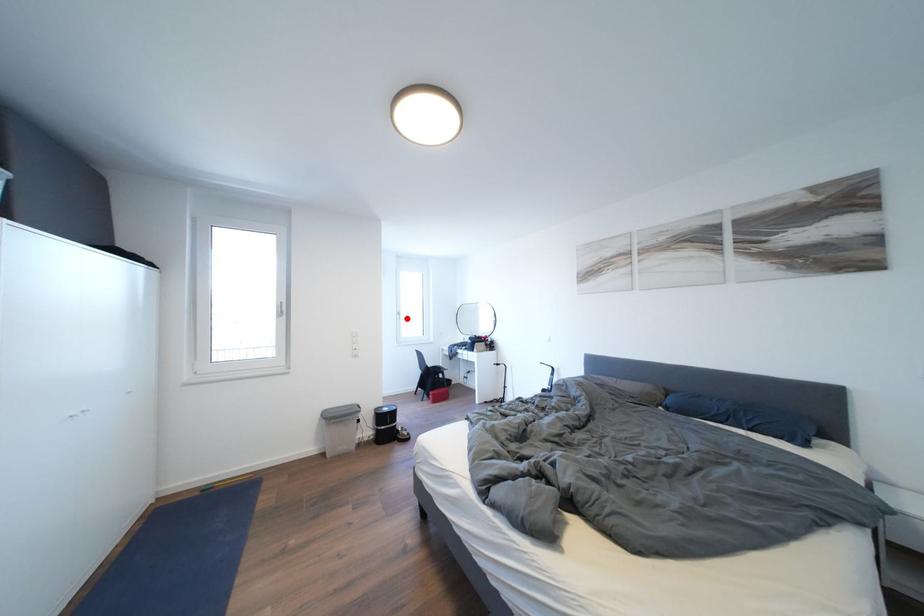
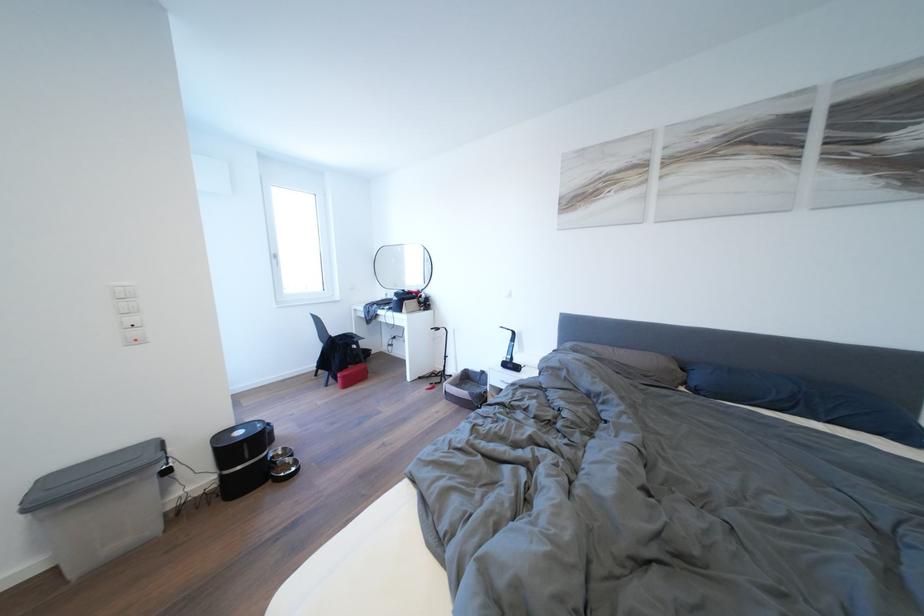
Where in the second image is the point corresponding to the highlighted location from the first image?

(284, 261)